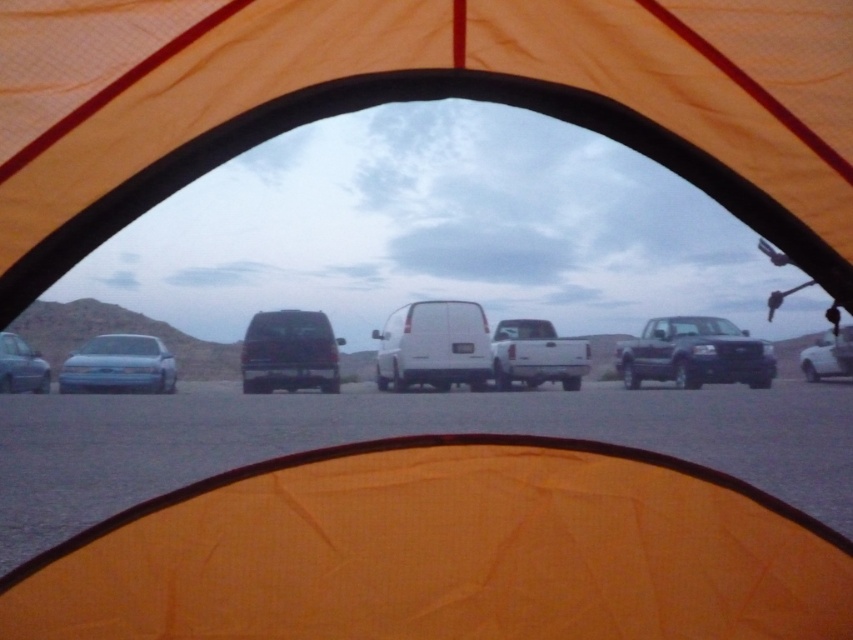
Question: Is dark gray matte van at center smaller than white glossy car at right?

Choices:
 (A) yes
 (B) no

Answer: (A)

Question: Which point is closer to the camera?

Choices:
 (A) white glossy car at right
 (B) orange fabric canopy at center
 (C) white matte truck at center
 (D) gray asphalt parking lot at center

Answer: (B)

Question: Which point appears closest to the camera in this image?

Choices:
 (A) (672, 378)
 (B) (456, 328)

Answer: (B)

Question: Does gray asphalt parking lot at center have a lesser width compared to matte blue sedan at left?

Choices:
 (A) yes
 (B) no

Answer: (A)

Question: Which point is farther to the camera?

Choices:
 (A) white glossy car at right
 (B) gray asphalt parking lot at center
 (C) white matte van at center
 (D) matte silver sedan at left

Answer: (D)

Question: Is matte blue sedan at left below matte silver sedan at left?

Choices:
 (A) no
 (B) yes

Answer: (B)